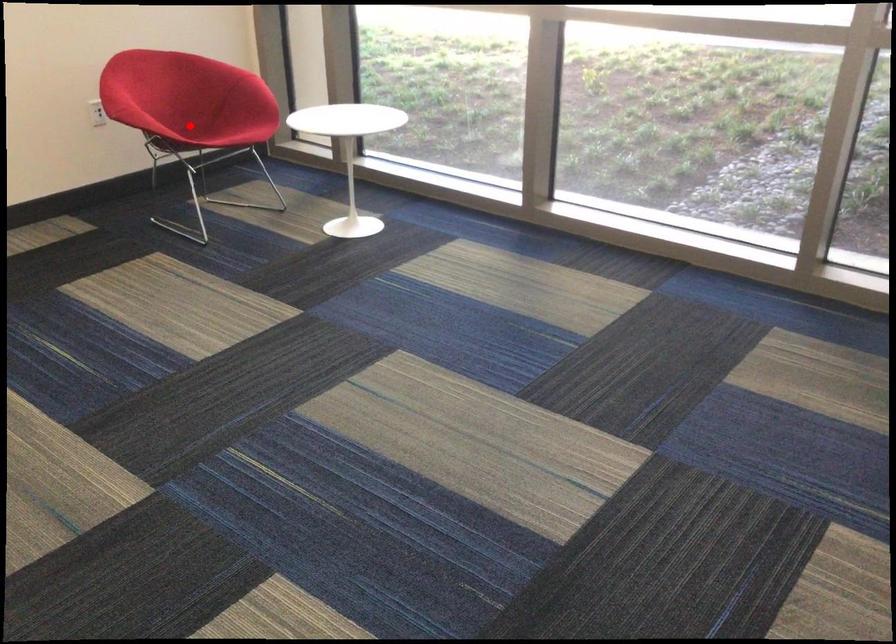
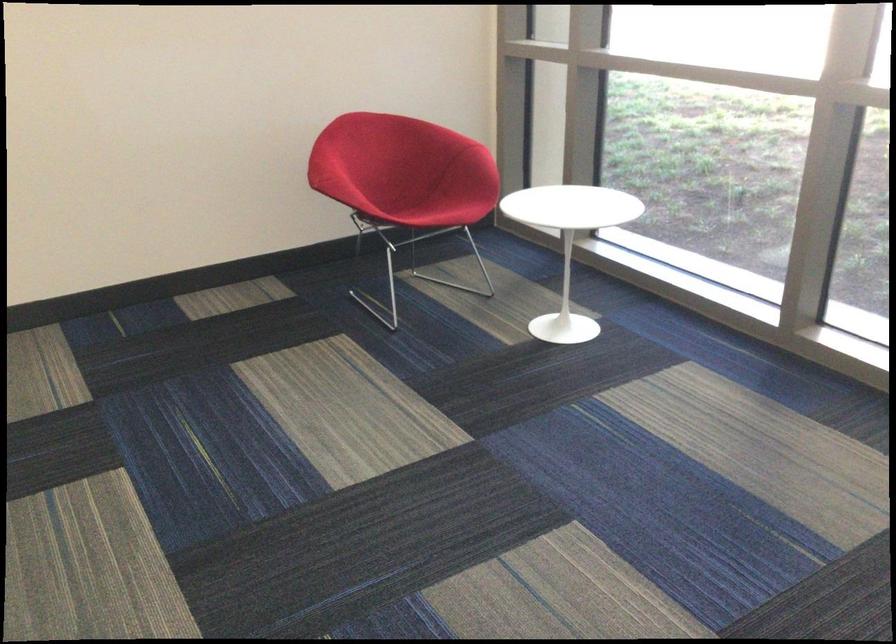
Find the pixel in the second image that matches the highlighted location in the first image.

(403, 194)